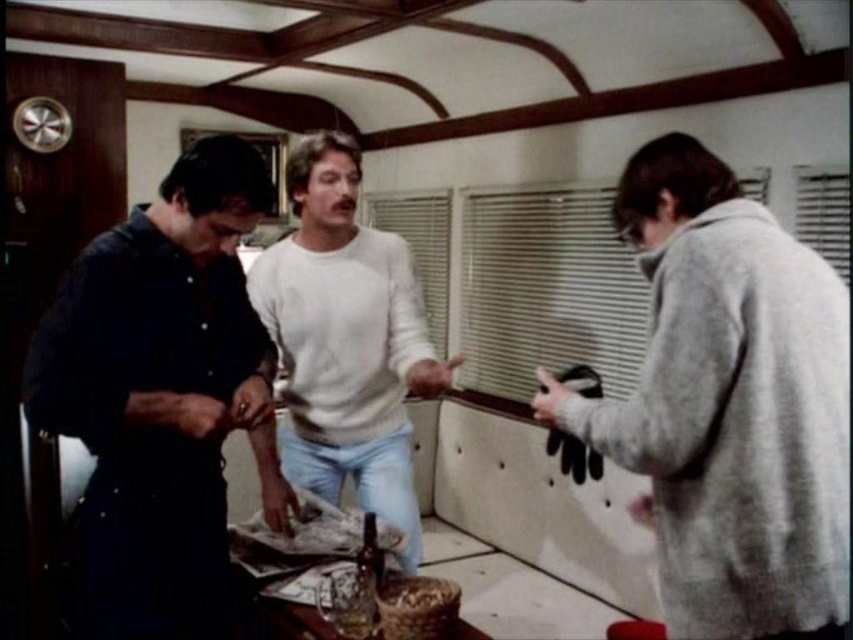
I want to click on dark blue shirt at left, so click(x=157, y=394).

Is dark blue shirt at left above white soft sweater at center?

Incorrect, dark blue shirt at left is not positioned above white soft sweater at center.

At what (x,y) coordinates should I click in order to perform the action: click on dark blue shirt at left. Please return your answer as a coordinate pair (x, y). The width and height of the screenshot is (853, 640). Looking at the image, I should click on (157, 394).

At what (x,y) coordinates should I click in order to perform the action: click on dark blue shirt at left. Please return your answer as a coordinate pair (x, y). The width and height of the screenshot is (853, 640). Looking at the image, I should click on (157, 394).

Does point (120, 560) lie behind point (366, 570)?

No, (120, 560) is closer to viewer.

Can you confirm if dark blue shirt at left is bigger than shiny brown bottle at center?

Yes, dark blue shirt at left is bigger than shiny brown bottle at center.

Does point (86, 339) come farther from viewer compared to point (378, 552)?

No, (86, 339) is closer to viewer.

Locate an element on the screen. dark blue shirt at left is located at coordinates pyautogui.click(x=157, y=394).

Is gray wool sweater at right smaller than shiny brown bottle at center?

No.

Looking at this image, who is positioned more to the right, gray wool sweater at right or shiny brown bottle at center?

gray wool sweater at right is more to the right.

What do you see at coordinates (729, 404) in the screenshot? This screenshot has width=853, height=640. I see `gray wool sweater at right` at bounding box center [729, 404].

Where is `gray wool sweater at right`? gray wool sweater at right is located at coordinates (729, 404).